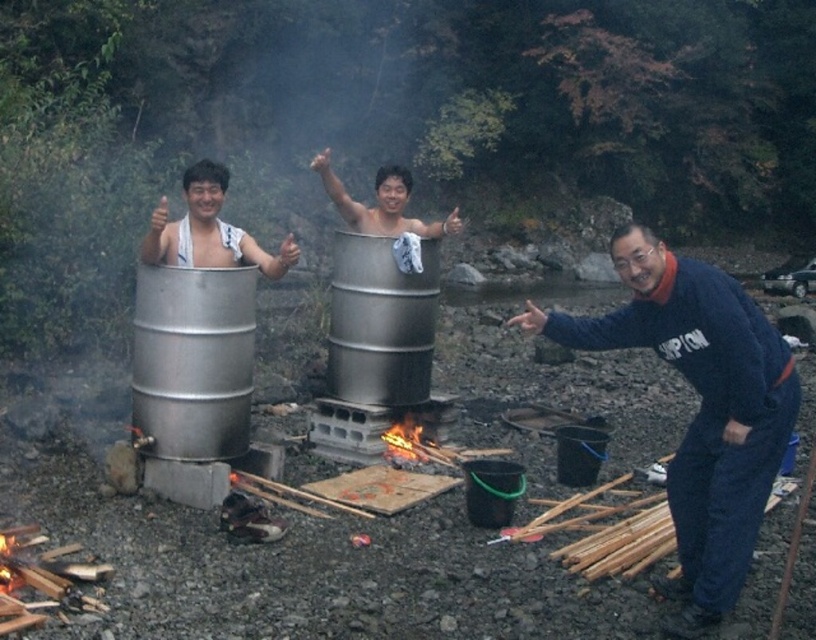
Question: Which of the following is the farthest from the observer?

Choices:
 (A) blue fleece jacket at lower right
 (B) charcoal wood fire at center

Answer: (B)

Question: Can you confirm if blue fleece jacket at lower right is wider than charcoal wood fire at center?

Choices:
 (A) no
 (B) yes

Answer: (B)

Question: Which object is positioned farthest from the charcoal wood fire at center?

Choices:
 (A) silver metallic tub at center
 (B) blue fleece jacket at lower right

Answer: (B)

Question: Which of the following is the closest to the observer?

Choices:
 (A) (206, 212)
 (B) (730, 385)

Answer: (B)

Question: In this image, where is silver metallic tub at center located relative to charcoal wood fire at center?

Choices:
 (A) above
 (B) below

Answer: (A)

Question: Is blue fleece jacket at lower right smaller than charcoal wood fire at center?

Choices:
 (A) no
 (B) yes

Answer: (A)